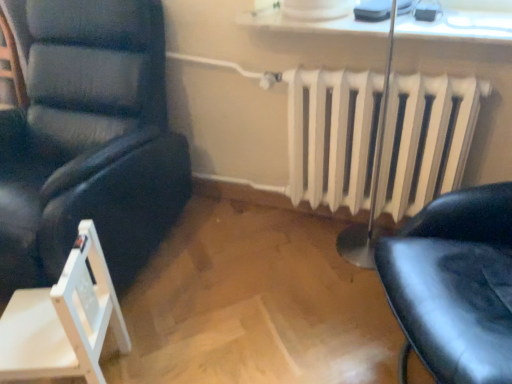
Question: Is white glossy window sill at upper center wider or thinner than matte black chair at left, which is the 2th chair in bottom-to-top order?

Choices:
 (A) wide
 (B) thin

Answer: (B)

Question: Would you say white glossy window sill at upper center is to the left or to the right of matte black chair at left, which is counted as the first chair, starting from the top, in the picture?

Choices:
 (A) right
 (B) left

Answer: (A)

Question: Considering the real-world distances, which object is closest to the white painted metal radiator at center?

Choices:
 (A) matte black chair at left, which is the 2th chair in bottom-to-top order
 (B) white wood folding chair at lower left, the first chair ordered from the bottom
 (C) white glossy window sill at upper center

Answer: (C)

Question: Considering the real-world distances, which object is closest to the white wood folding chair at lower left, marked as the second chair in a top-to-bottom arrangement?

Choices:
 (A) white painted metal radiator at center
 (B) matte black chair at left, which is counted as the first chair, starting from the top
 (C) white glossy window sill at upper center

Answer: (B)